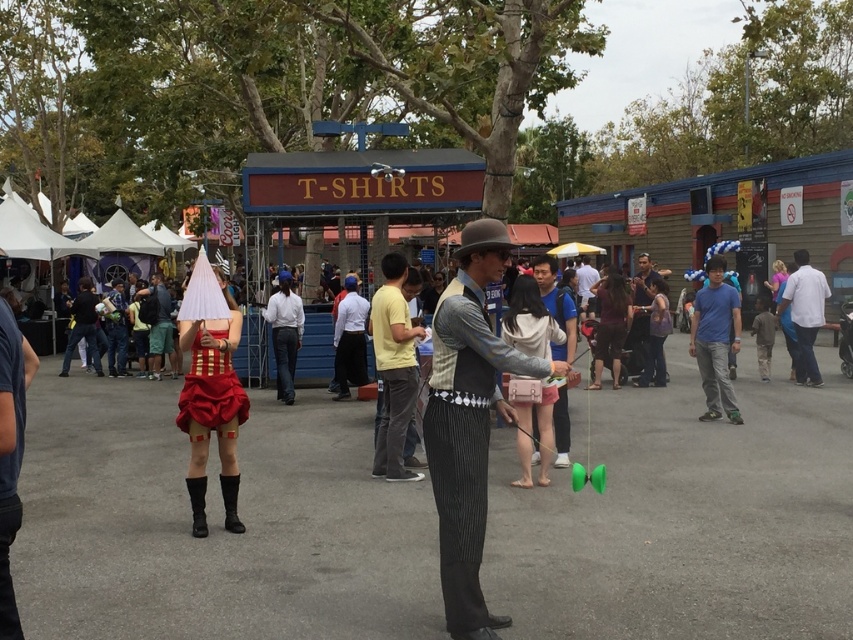
You are at the fair and want to buy a blue cotton shirt at center. The TSHIRTS stall is located at point 0.5, 0.5. Can you walk straight from the stall to the shirt?

The blue cotton shirt at center is located at point (715, 340). Since the TSHIRTS stall is at (426, 320), walking straight from the stall would lead you towards the shirt as it is in the same general direction.

Based on the photo, you are trying to decide which outfit to buy between the silver metallic vest at center and the light brown leather jacket at center. Based on the description, which one is more suitable for a casual summer day?

The silver metallic vest at center is smaller than the light brown leather jacket at center, so it might be more suitable for a casual summer day as it is lighter and less bulky.